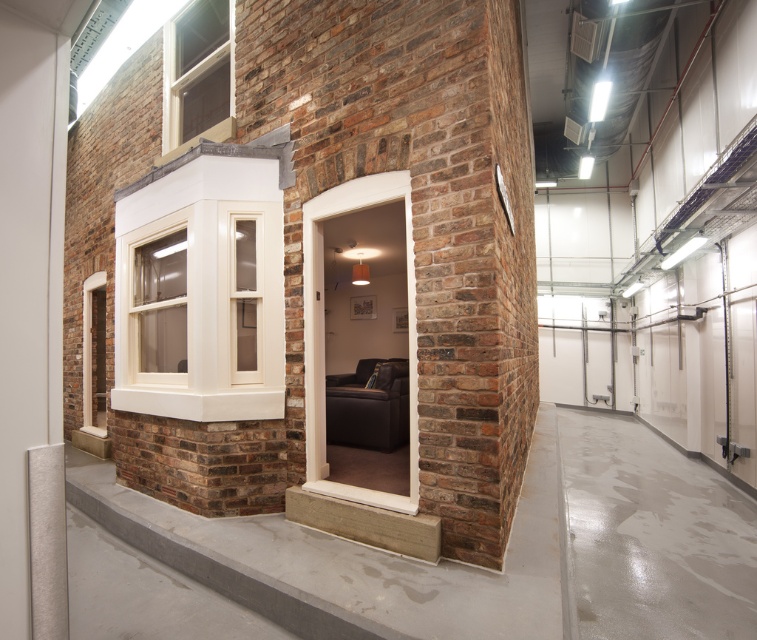
You are an interior designer planning to install a decorative shelf. You have a shelf that is 1.2 meters wide. You see the brown brick at center and the white glossy window at upper left. Which object can the shelf fit in front of without overlapping either side?

The brown brick at center has a lesser width compared to the white glossy window at upper left. Since the shelf is 1.2 meters wide, it can fit in front of the white glossy window at upper left because it is wider than the shelf. The brown brick at center is narrower, so the shelf would overlap its sides.

You are standing in front of the brick wall and want to touch the windows. Which window can you reach first when moving forward towards the brick wall, the white glossy window at upper left or the white wood window at upper left?

The white glossy window at upper left is closer to the viewer than the white wood window at upper left, so you can reach the white glossy window at upper left first.

You are an architect designing a new facade for a building. You want to ensure that the brown brick at center and the matte white window at upper left are proportionally balanced. Given their current widths, which element should you adjust to achieve this balance?

The brown brick at center has a lesser width compared to matte white window at upper left. To achieve proportional balance, you should increase the width of the brown brick at center to match or complement the width of the matte white window at upper left.